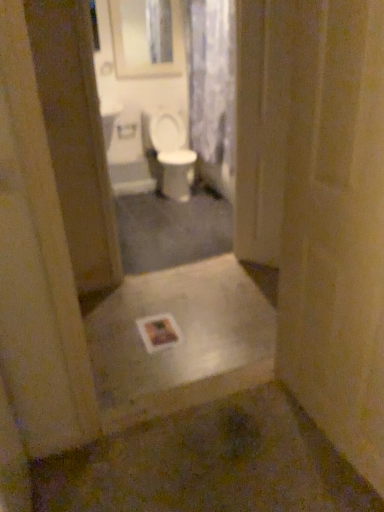
This screenshot has width=384, height=512. Describe the element at coordinates (126, 130) in the screenshot. I see `white matte toilet paper at center` at that location.

In order to face smooth cream door at right, should I rotate leftwards or rightwards?

Turn right by 20.211 degrees to look at smooth cream door at right.

What is the approximate width of translucent floral fabric at upper center?

The width of translucent floral fabric at upper center is 8.74 inches.

Find the location of a particular element. This screenshot has width=384, height=512. translucent floral fabric at upper center is located at coordinates pos(212,79).

At what (x,y) coordinates should I click in order to perform the action: click on white glossy toilet at center. Please return your answer as a coordinate pair (x, y). This screenshot has height=512, width=384. Looking at the image, I should click on (171, 154).

From the image's perspective, relative to transparent plastic screen door at center, is smooth cream door at right above or below?

From the image's perspective, smooth cream door at right appears below transparent plastic screen door at center.

Is smooth cream door at right at the left side of transparent plastic screen door at center?

Incorrect, smooth cream door at right is not on the left side of transparent plastic screen door at center.

From the picture: From their relative heights in the image, would you say smooth cream door at right is taller or shorter than transparent plastic screen door at center?

smooth cream door at right is shorter than transparent plastic screen door at center.

Is transparent plastic screen door at center at the back of smooth cream door at right?

No, smooth cream door at right is not facing the opposite direction of transparent plastic screen door at center.

From the picture: Does transparent plastic screen door at center have a larger size compared to white glossy toilet at center?

Incorrect, transparent plastic screen door at center is not larger than white glossy toilet at center.

In terms of width, does transparent plastic screen door at center look wider or thinner when compared to white glossy toilet at center?

Considering their sizes, transparent plastic screen door at center looks slimmer than white glossy toilet at center.

How different are the orientations of transparent plastic screen door at center and white glossy toilet at center in degrees?

There is a 49.1-degree angle between the facing directions of transparent plastic screen door at center and white glossy toilet at center.

Is transparent plastic screen door at center inside or outside of white glossy toilet at center?

transparent plastic screen door at center is not inside white glossy toilet at center, it's outside.

From the image's perspective, is white glossy toilet at center over translucent floral fabric at upper center?

No, from the image's perspective, white glossy toilet at center is not above translucent floral fabric at upper center.

From the picture: Is white glossy toilet at center positioned beyond the bounds of translucent floral fabric at upper center?

Absolutely, white glossy toilet at center is external to translucent floral fabric at upper center.

Based on their positions, is white glossy toilet at center located to the left or right of translucent floral fabric at upper center?

white glossy toilet at center is to the left of translucent floral fabric at upper center.

From the picture: From a real-world perspective, is white glossy toilet at center above or below translucent floral fabric at upper center?

Clearly, from a real-world perspective, white glossy toilet at center is below translucent floral fabric at upper center.

Considering the sizes of transparent plastic screen door at center and translucent floral fabric at upper center in the image, is transparent plastic screen door at center wider or thinner than translucent floral fabric at upper center?

Clearly, transparent plastic screen door at center has less width compared to translucent floral fabric at upper center.

Which of these two, transparent plastic screen door at center or translucent floral fabric at upper center, stands shorter?

translucent floral fabric at upper center is shorter.

Is transparent plastic screen door at center positioned before translucent floral fabric at upper center?

Yes, it is in front of translucent floral fabric at upper center.

From a real-world perspective, is transparent plastic screen door at center physically above translucent floral fabric at upper center?

No.

Identify the location of screen door behind the smooth cream door at right. This screenshot has width=384, height=512. (260, 128).

From a real-world perspective, is transparent plastic screen door at center on top of smooth cream door at right?

Yes, from a real-world perspective, transparent plastic screen door at center is above smooth cream door at right.

Consider the image. Is transparent plastic screen door at center closer to camera compared to smooth cream door at right?

No, transparent plastic screen door at center is behind smooth cream door at right.

How much distance is there between transparent plastic screen door at center and smooth cream door at right?

The distance of transparent plastic screen door at center from smooth cream door at right is 3.82 feet.

Consider the image. Which is behind, smooth cream door at right or translucent floral fabric at upper center?

translucent floral fabric at upper center is further from the camera.

Considering the sizes of objects smooth cream door at right and translucent floral fabric at upper center in the image provided, who is thinner, smooth cream door at right or translucent floral fabric at upper center?

Thinner between the two is smooth cream door at right.

From a real-world perspective, is smooth cream door at right positioned above or below translucent floral fabric at upper center?

smooth cream door at right is situated lower than translucent floral fabric at upper center in the real world.

Based on the photo, is smooth cream door at right turned away from translucent floral fabric at upper center?

smooth cream door at right does not have its back to translucent floral fabric at upper center.

Does metallic silver step at center have a lesser height compared to transparent plastic screen door at center?

Yes, metallic silver step at center is shorter than transparent plastic screen door at center.

Is metallic silver step at center in front of or behind transparent plastic screen door at center in the image?

metallic silver step at center is in front of transparent plastic screen door at center.

Is metallic silver step at center positioned with its back to transparent plastic screen door at center?

That's not correct — metallic silver step at center is not looking away from transparent plastic screen door at center.

Locate an element on the screen. This screenshot has height=512, width=384. screen door behind the metallic silver step at center is located at coordinates (260, 128).

Locate an element on the screen. screen door on the left side of smooth cream door at right is located at coordinates (260, 128).

In order to click on toilet below the transparent plastic screen door at center (from a real-world perspective) in this screenshot , I will do `click(171, 154)`.

When comparing their distances from matte glass medicine cabinet at upper center, does white glossy toilet at center or metallic silver step at center seem closer?

Based on the image, white glossy toilet at center appears to be nearer to matte glass medicine cabinet at upper center.

From the image, which object appears to be farther from white matte toilet paper at center, matte glass medicine cabinet at upper center or white glossy toilet at center?

Based on the image, matte glass medicine cabinet at upper center appears to be further to white matte toilet paper at center.

Looking at the image, which one is located further to translucent floral fabric at upper center, matte glass medicine cabinet at upper center or smooth cream door at right?

smooth cream door at right is further to translucent floral fabric at upper center.

Which object lies further to the anchor point metallic silver step at center, translucent floral fabric at upper center or smooth cream door at right?

The object further to metallic silver step at center is translucent floral fabric at upper center.

When comparing their distances from smooth cream door at right, does transparent plastic screen door at center or white glossy toilet at center seem closer?

Based on the image, transparent plastic screen door at center appears to be nearer to smooth cream door at right.

Which object lies nearer to the anchor point metallic silver step at center, translucent floral fabric at upper center or white glossy toilet at center?

translucent floral fabric at upper center is closer to metallic silver step at center.

When comparing their distances from transparent plastic screen door at center, does metallic silver step at center or smooth cream door at right seem further?

smooth cream door at right is further to transparent plastic screen door at center.

Looking at the image, which one is located further to white glossy toilet at center, smooth cream door at right or translucent floral fabric at upper center?

smooth cream door at right is positioned further to the anchor white glossy toilet at center.

Find the location of `screen door between matte glass medicine cabinet at upper center and metallic silver step at center from top to bottom`. screen door between matte glass medicine cabinet at upper center and metallic silver step at center from top to bottom is located at coordinates (260, 128).

The height and width of the screenshot is (512, 384). Identify the location of toilet located between transparent plastic screen door at center and white matte toilet paper at center in the depth direction. (171, 154).

Locate an element on the screen. shower curtain between matte glass medicine cabinet at upper center and metallic silver step at center in the up-down direction is located at coordinates (212, 79).

Find the location of a particular element. The width and height of the screenshot is (384, 512). screen door between smooth cream door at right and translucent floral fabric at upper center along the z-axis is located at coordinates (260, 128).